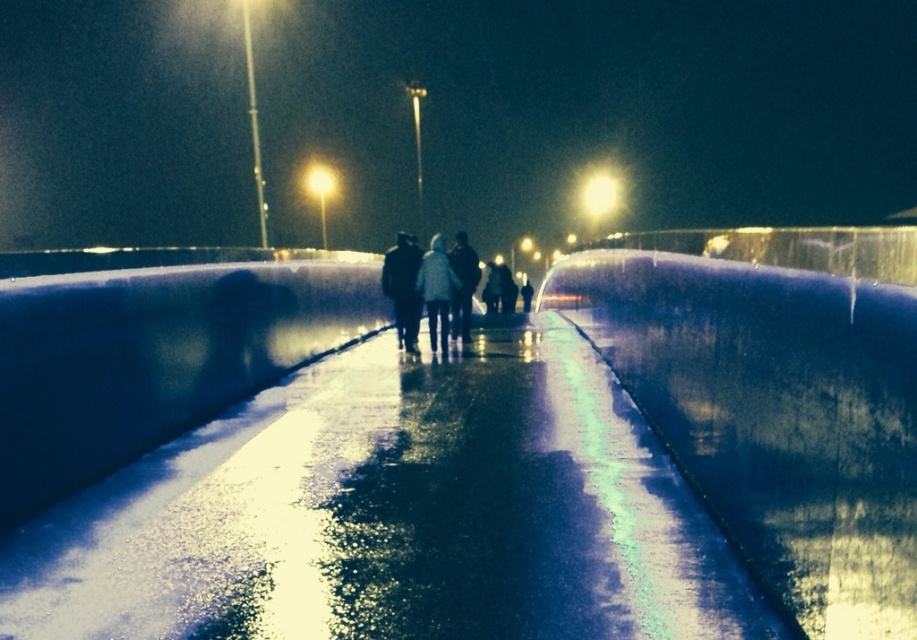
You are a photographer standing on the walkway. You notice the smooth concrete wall at center and the dark fabric coat at center. Which object is closer to you?

The smooth concrete wall at center is closer to you because it is in front of the dark fabric coat at center.

You are standing on the glossy concrete path at center and want to reach the silhouette wool coat at center. Which direction should you move to get closer to it?

Since the glossy concrete path at center is closer to the viewer than the silhouette wool coat at center, you should move forward towards the coat to get closer to it.